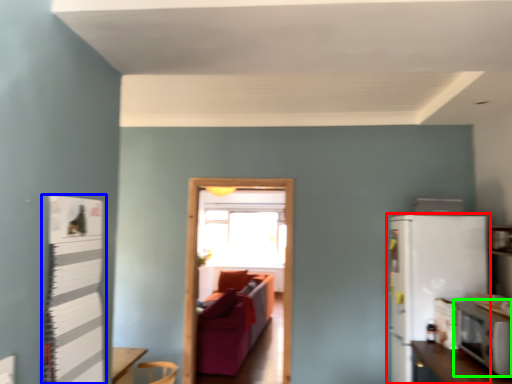
Question: Which object is positioned farthest from refrigerator (highlighted by a red box)? Select from bulletin board (highlighted by a blue box) and appliance (highlighted by a green box).

Choices:
 (A) bulletin board
 (B) appliance

Answer: (A)